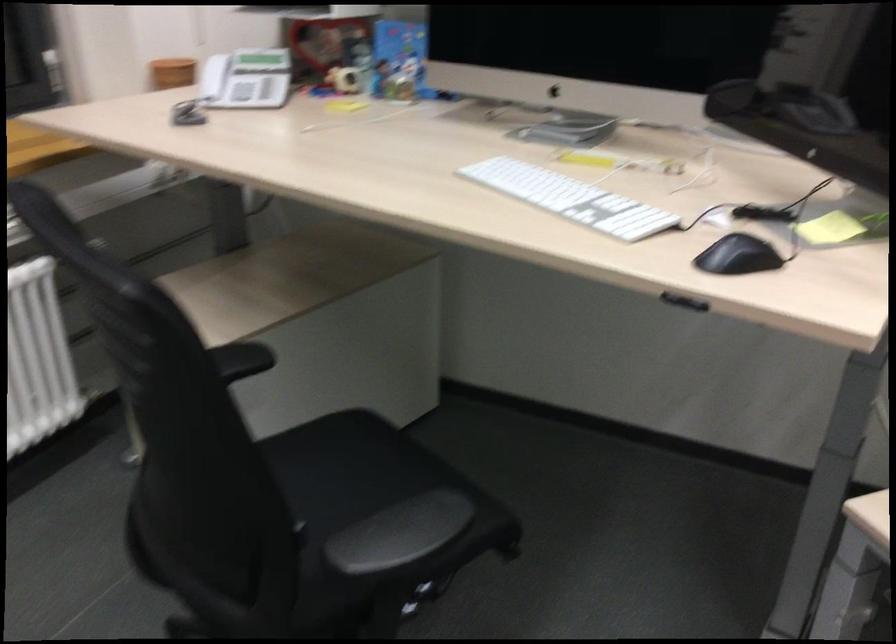
Where would you grasp the black computer mouse? Please return your answer as a coordinate pair (x, y).

(737, 256)